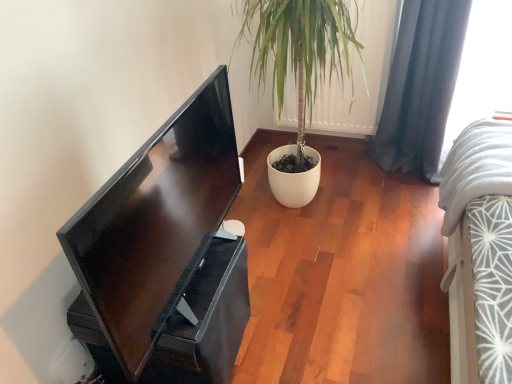
Question: Can you confirm if matte black monitor at left is taller than white fabric at upper right?

Choices:
 (A) no
 (B) yes

Answer: (A)

Question: Would you say matte black monitor at left is outside white fabric at upper right?

Choices:
 (A) yes
 (B) no

Answer: (A)

Question: Considering the relative positions of matte black monitor at left and white fabric at upper right in the image provided, is matte black monitor at left behind white fabric at upper right?

Choices:
 (A) yes
 (B) no

Answer: (B)

Question: From the image's perspective, does matte black monitor at left appear lower than white fabric at upper right?

Choices:
 (A) no
 (B) yes

Answer: (B)

Question: Does matte black monitor at left have a lesser height compared to white fabric at upper right?

Choices:
 (A) no
 (B) yes

Answer: (B)

Question: Looking at the image, does dark blue fabric curtain at right seem bigger or smaller compared to white fabric at upper right?

Choices:
 (A) small
 (B) big

Answer: (A)

Question: Would you say dark blue fabric curtain at right is to the left or to the right of white fabric at upper right in the picture?

Choices:
 (A) left
 (B) right

Answer: (A)

Question: Relative to white fabric at upper right, is dark blue fabric curtain at right in front or behind?

Choices:
 (A) behind
 (B) front

Answer: (A)

Question: From the image's perspective, relative to white fabric at upper right, is dark blue fabric curtain at right above or below?

Choices:
 (A) above
 (B) below

Answer: (A)

Question: From their relative heights in the image, would you say white fabric at upper right is taller or shorter than matte black monitor at left?

Choices:
 (A) tall
 (B) short

Answer: (A)

Question: In the image, is white fabric at upper right on the left side or the right side of matte black monitor at left?

Choices:
 (A) right
 (B) left

Answer: (A)

Question: Is point (502, 89) positioned closer to the camera than point (198, 97)?

Choices:
 (A) farther
 (B) closer

Answer: (A)

Question: Is white fabric at upper right in front of or behind matte black monitor at left in the image?

Choices:
 (A) behind
 (B) front

Answer: (A)

Question: Is dark blue fabric curtain at right inside the boundaries of matte black monitor at left, or outside?

Choices:
 (A) inside
 (B) outside

Answer: (B)

Question: Considering the positions of point (429, 162) and point (138, 160), is point (429, 162) closer or farther from the camera than point (138, 160)?

Choices:
 (A) closer
 (B) farther

Answer: (B)